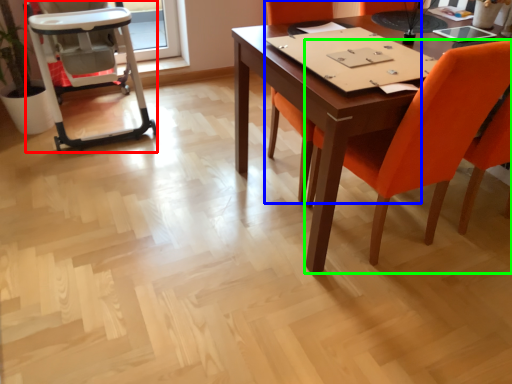
Question: Which object is the farthest from armchair (highlighted by a red box)? Choose among these: chair (highlighted by a blue box) or chair (highlighted by a green box).

Choices:
 (A) chair
 (B) chair

Answer: (B)